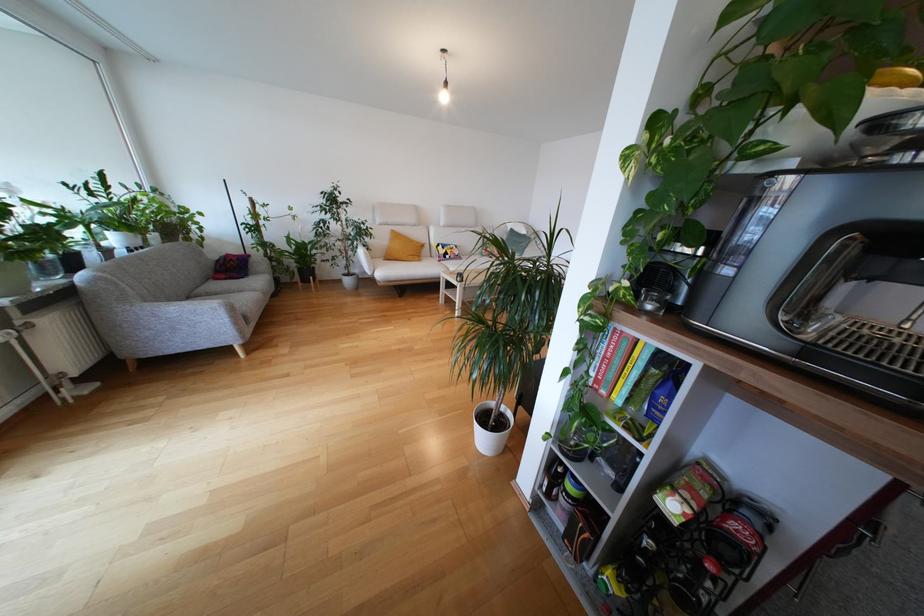
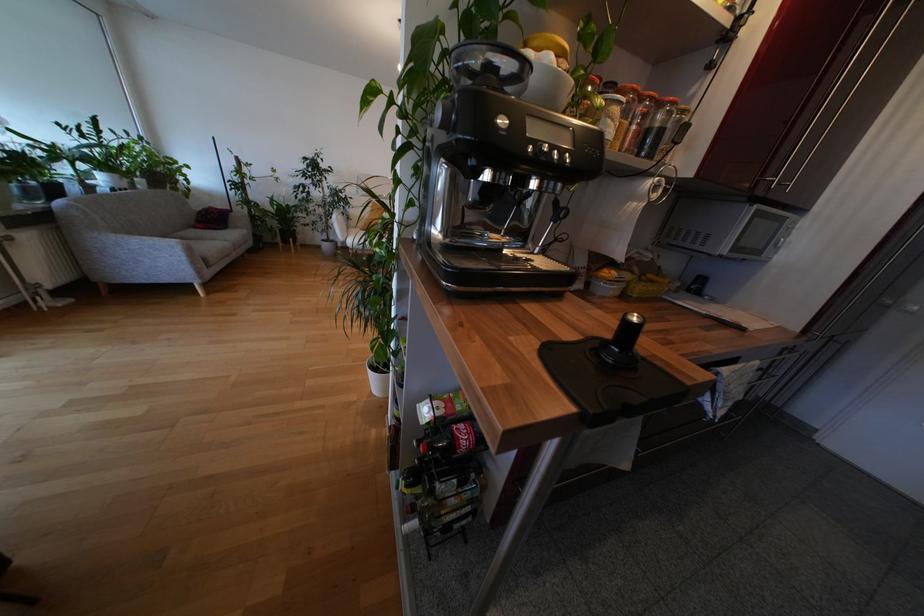
Find the pixel in the second image that matches (x=670, y=493) in the first image.

(431, 402)